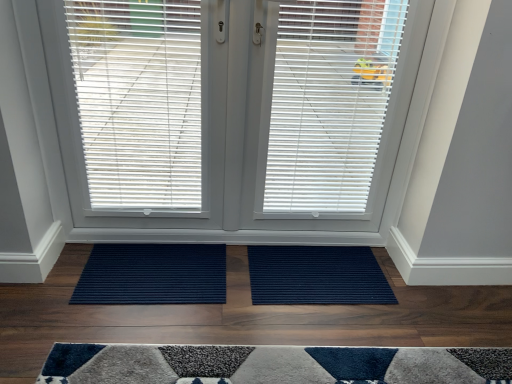
Question: From the image's perspective, is white plastic blinds at center, the 3th window blind in the right-to-left sequence, above or below navy blue ribbed mat at center, the 1th doormat when ordered from right to left?

Choices:
 (A) above
 (B) below

Answer: (A)

Question: Based on their sizes in the image, would you say white plastic blinds at center, the 1th window blind in the left-to-right sequence, is bigger or smaller than navy blue ribbed mat at center, placed as the 2th doormat when sorted from left to right?

Choices:
 (A) big
 (B) small

Answer: (A)

Question: Which is farther from the navy blue ribbed mat at center, the 1th doormat when ordered from right to left?

Choices:
 (A) white matte window blind at center, placed as the 3th window blind when sorted from left to right
 (B) white matte window blind at center, the 2th window blind when ordered from left to right
 (C) white plastic blinds at center, the 3th window blind in the right-to-left sequence
 (D) navy ribbed mat at center, which is counted as the 2th doormat, starting from the right

Answer: (C)

Question: Which of these objects is positioned closest to the white matte window blind at center, the second window blind viewed from the right?

Choices:
 (A) white plastic blinds at center, the 1th window blind in the left-to-right sequence
 (B) navy ribbed mat at center, which is counted as the 2th doormat, starting from the right
 (C) white matte window blind at center, placed as the first window blind when sorted from right to left
 (D) navy blue ribbed mat at center, the 1th doormat when ordered from right to left

Answer: (C)